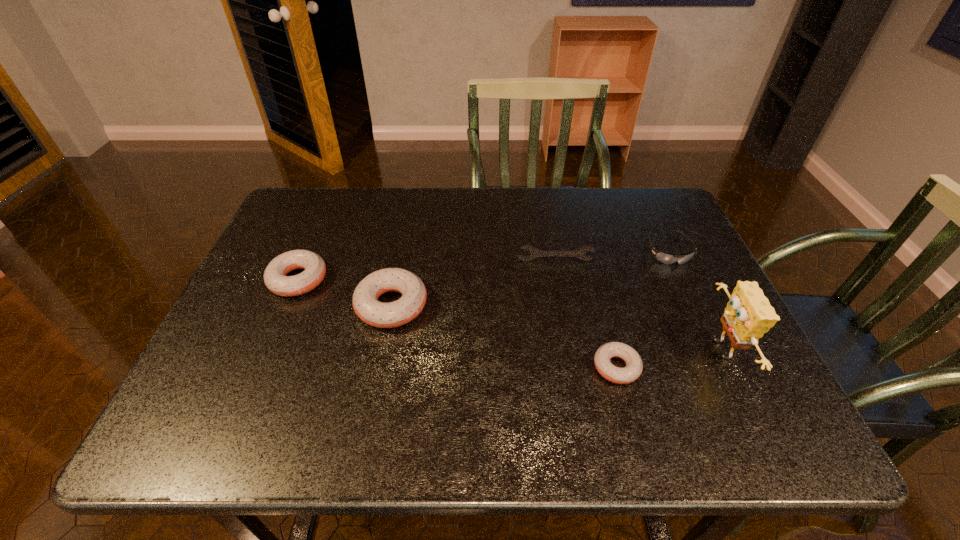
Where is `free spot located 0.240m on the back of the nearest doughnut`? This screenshot has height=540, width=960. free spot located 0.240m on the back of the nearest doughnut is located at coordinates (591, 273).

Image resolution: width=960 pixels, height=540 pixels. I want to click on vacant position located 0.060m on the lenses of the sunglasses, so click(x=684, y=284).

Image resolution: width=960 pixels, height=540 pixels. I want to click on blank area located on the open ends of the wrench, so click(x=560, y=288).

Locate an element on the screen. free space located on the face of the tallest object is located at coordinates (526, 350).

Identify the location of free space located 0.380m on the face of the tallest object. click(530, 350).

Image resolution: width=960 pixels, height=540 pixels. I want to click on vacant space located on the face of the tallest object, so click(x=639, y=350).

This screenshot has height=540, width=960. I want to click on doughnut at the near edge, so 634,366.

Find the location of `sponge positioned at the near edge`. sponge positioned at the near edge is located at coordinates (748, 315).

This screenshot has width=960, height=540. I want to click on object that is at the left edge, so (275, 278).

Locate an element on the screen. Image resolution: width=960 pixels, height=540 pixels. sunglasses that is positioned at the right edge is located at coordinates (664, 258).